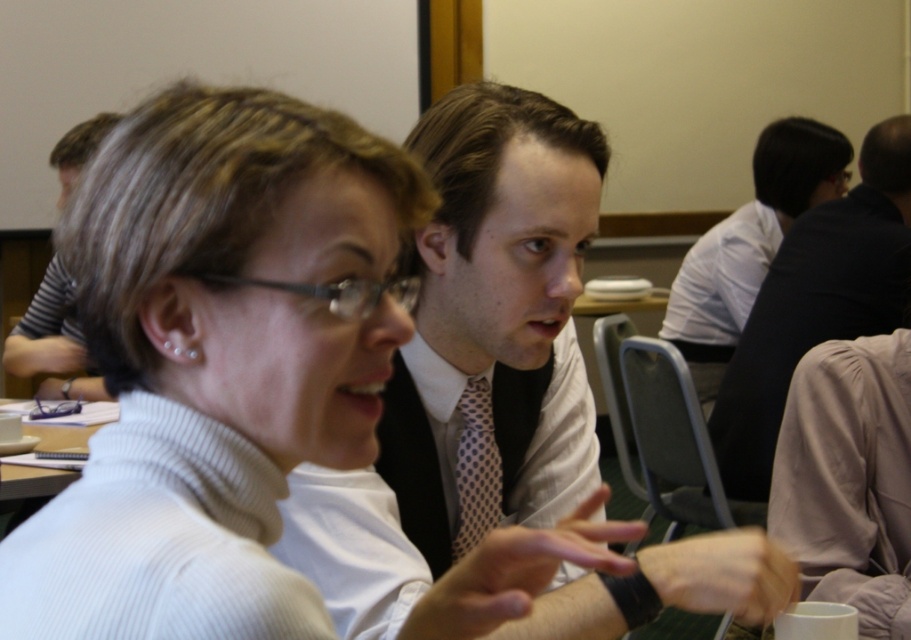
Is matte black shirt at upper left shorter than polka dot fabric tie at center?

In fact, matte black shirt at upper left may be taller than polka dot fabric tie at center.

Can you confirm if matte black shirt at upper left is smaller than polka dot fabric tie at center?

No, matte black shirt at upper left is not smaller than polka dot fabric tie at center.

Identify the location of matte black shirt at upper left. The image size is (911, 640). (52, 340).

Locate an element on the screen. The image size is (911, 640). polka dot fabric tie at center is located at coordinates (476, 468).

Is polka dot fabric tie at center to the left of white paper at upper left from the viewer's perspective?

In fact, polka dot fabric tie at center is to the right of white paper at upper left.

Where is `polka dot fabric tie at center`? polka dot fabric tie at center is located at coordinates (476, 468).

Between matte black shirt at upper left and white paper at upper left, which one has more height?

matte black shirt at upper left

Can you confirm if matte black shirt at upper left is positioned above white paper at upper left?

Indeed, matte black shirt at upper left is positioned over white paper at upper left.

Between point (67, 364) and point (31, 484), which one is positioned behind?

The point (67, 364) is behind.

I want to click on matte black shirt at upper left, so click(x=52, y=340).